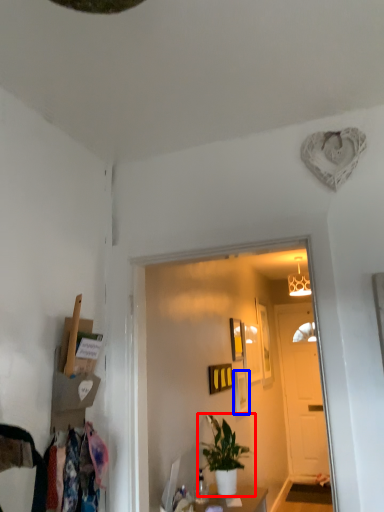
Question: Which of the following is the farthest to the observer, houseplant (highlighted by a red box) or picture frame (highlighted by a blue box)?

Choices:
 (A) houseplant
 (B) picture frame

Answer: (B)